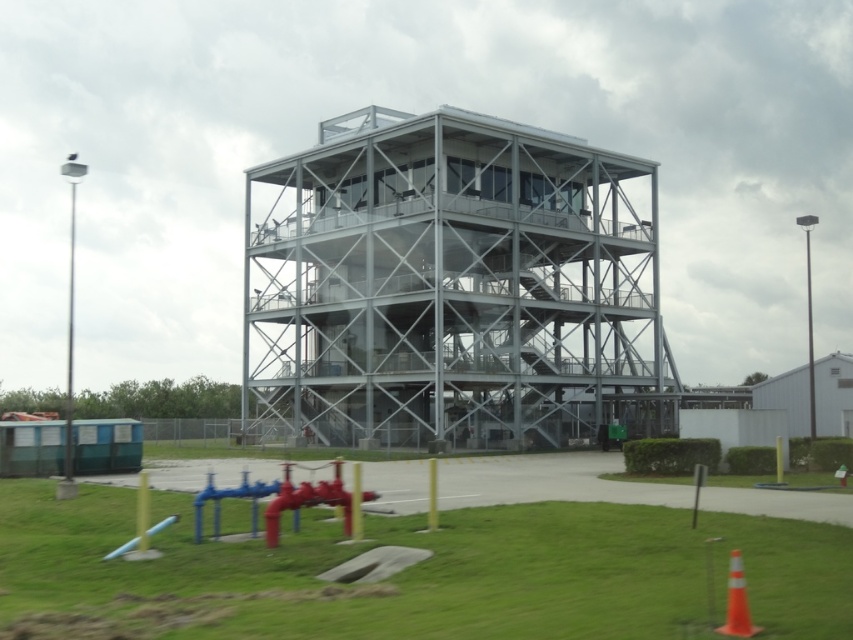
You are a maintenance worker needing to reach the metallic structure at center for repairs. You see the orange plastic cone at lower right nearby. Which object is closer to you, and why?

The orange plastic cone at lower right is closer to you because the metallic structure at center is further away, as it is positioned behind the cone in the scene.